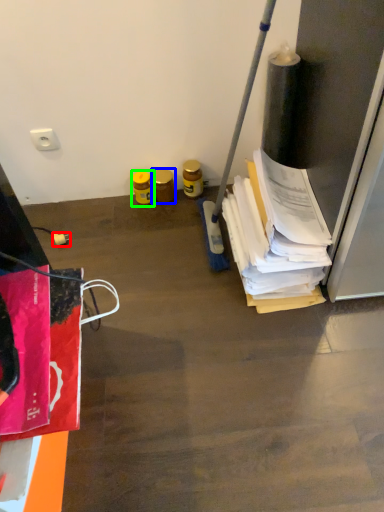
Question: Considering the real-world distances, which object is farthest from power plugs and sockets (highlighted by a red box)? bottle (highlighted by a blue box) or bottle (highlighted by a green box)?

Choices:
 (A) bottle
 (B) bottle

Answer: (A)